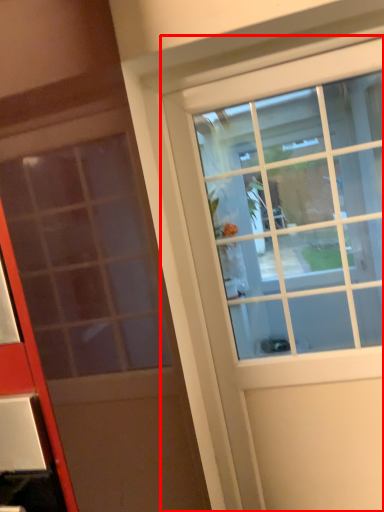
Question: Observing the image, what is the correct spatial positioning of door (annotated by the red box) in reference to door?

Choices:
 (A) right
 (B) left

Answer: (A)